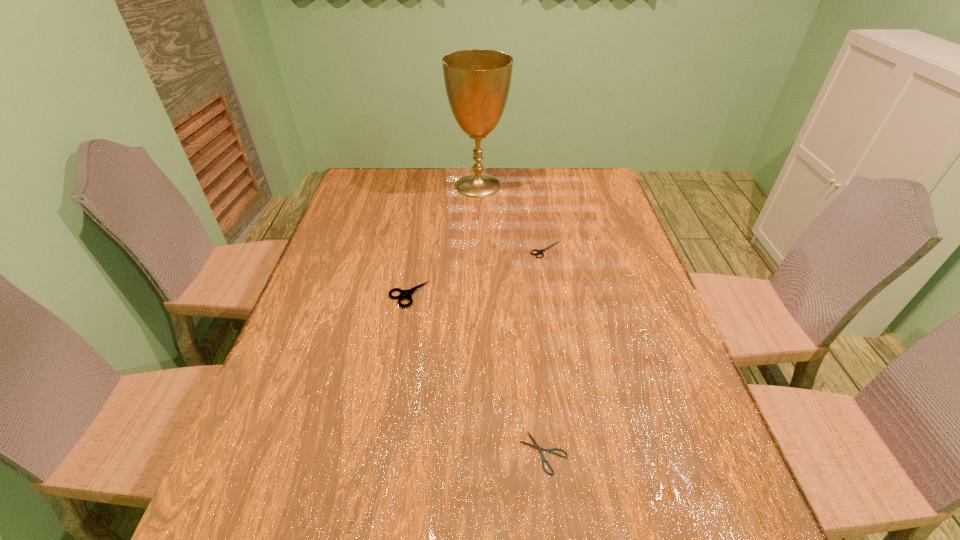
Locate an element on the screen. This screenshot has height=540, width=960. the farthest object is located at coordinates (477, 81).

At what (x,y) coordinates should I click in order to perform the action: click on trophy cup. Please return your answer as a coordinate pair (x, y). The width and height of the screenshot is (960, 540). Looking at the image, I should click on click(x=477, y=81).

I want to click on the tallest shears, so click(404, 294).

Where is `the second farthest shears`? This screenshot has width=960, height=540. the second farthest shears is located at coordinates pyautogui.click(x=404, y=294).

This screenshot has width=960, height=540. What are the coordinates of `the second farthest object` in the screenshot? It's located at (539, 252).

Identify the location of the second tallest shears. (539, 252).

Identify the location of the nearest object. The width and height of the screenshot is (960, 540). (536, 445).

Find the location of a particular element. The image size is (960, 540). the shortest shears is located at coordinates (536, 445).

At what (x,y) coordinates should I click in order to perform the action: click on vacant space located 0.160m on the right of the farthest object. Please return your answer as a coordinate pair (x, y). Looking at the image, I should click on (552, 186).

The image size is (960, 540). In order to click on vacant space located on the right of the second farthest shears in this screenshot , I will do `click(516, 295)`.